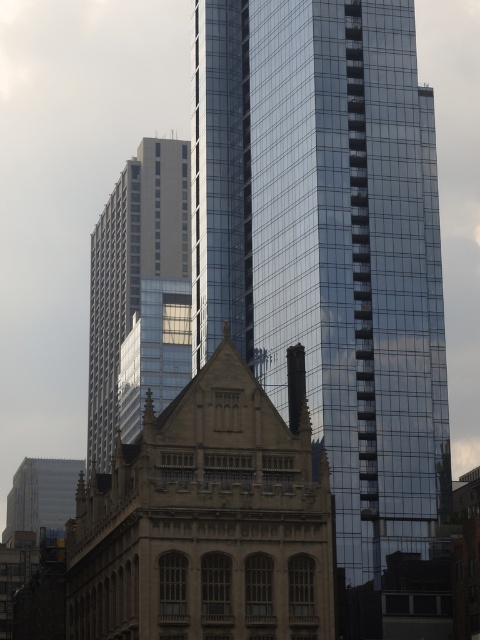
Question: Does brown stone bell tower at center have a larger size compared to silver metallic building at center?

Choices:
 (A) yes
 (B) no

Answer: (B)

Question: Is brown stone bell tower at center below silver metallic building at center?

Choices:
 (A) no
 (B) yes

Answer: (A)

Question: Considering the relative positions of brown stone bell tower at center and silver metallic building at center in the image provided, where is brown stone bell tower at center located with respect to silver metallic building at center?

Choices:
 (A) below
 (B) above

Answer: (B)

Question: Which object is farther from the camera taking this photo?

Choices:
 (A) silver metallic building at center
 (B) brown stone bell tower at center

Answer: (B)

Question: Which point is closer to the camera?

Choices:
 (A) (134, 342)
 (B) (304, 291)

Answer: (B)